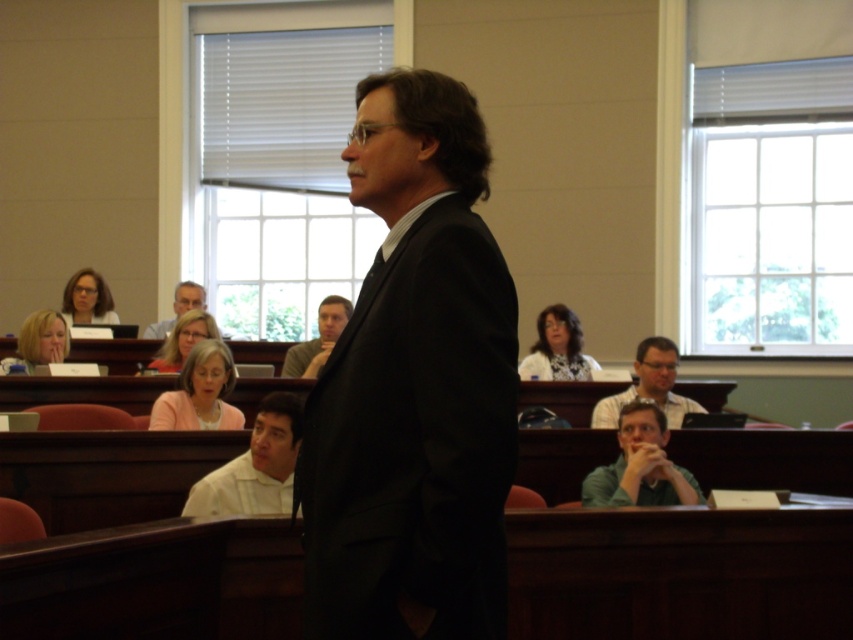
You are sitting at the back of the classroom and want to see the lecturer better. Which person is blocking your view between the white shirt at lower center and the gray fabric shirt at center?

The white shirt at lower center is blocking your view because it is in front of the gray fabric shirt at center.